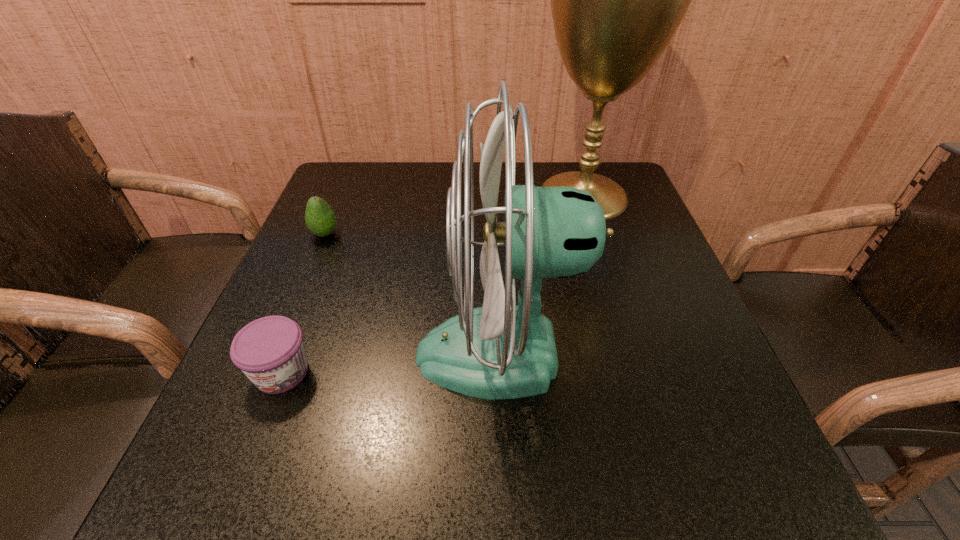
Where is `object at the far edge`? object at the far edge is located at coordinates (617, 0).

The width and height of the screenshot is (960, 540). In order to click on object that is at the near edge in this screenshot , I will do `click(501, 350)`.

Where is `avocado present at the left edge`? This screenshot has height=540, width=960. avocado present at the left edge is located at coordinates (320, 218).

Identify the location of jam that is at the left edge. (270, 351).

What are the coordinates of `object positioned at the right edge` in the screenshot? It's located at (617, 0).

Locate an element on the screen. The width and height of the screenshot is (960, 540). object present at the far right corner is located at coordinates (617, 0).

I want to click on vacant space at the far edge of the desktop, so click(449, 178).

The width and height of the screenshot is (960, 540). In the image, there is a desktop. What are the coordinates of `free region at the left edge` in the screenshot? It's located at (358, 220).

I want to click on vacant space at the right edge, so click(x=637, y=233).

Locate an element on the screen. This screenshot has height=540, width=960. free space at the far left corner of the desktop is located at coordinates (333, 201).